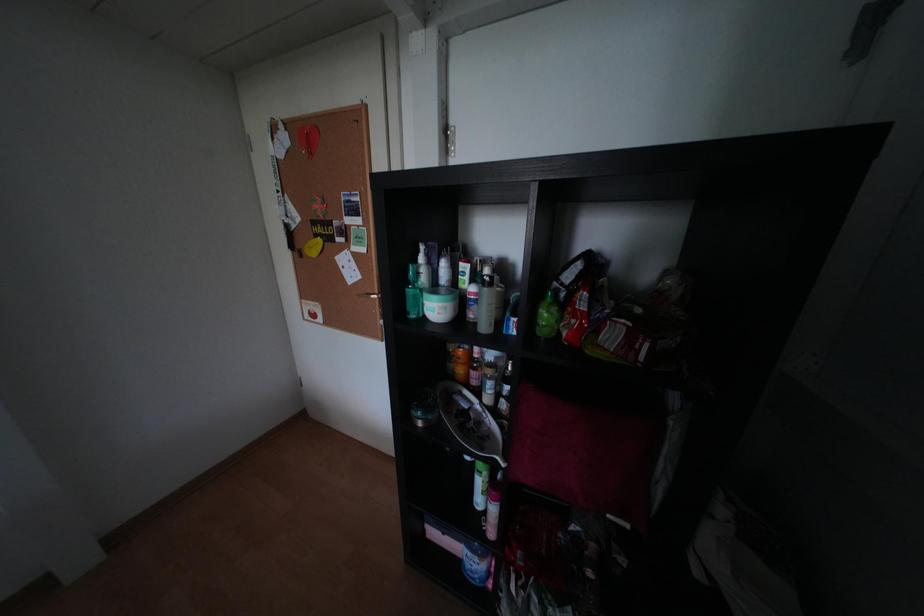
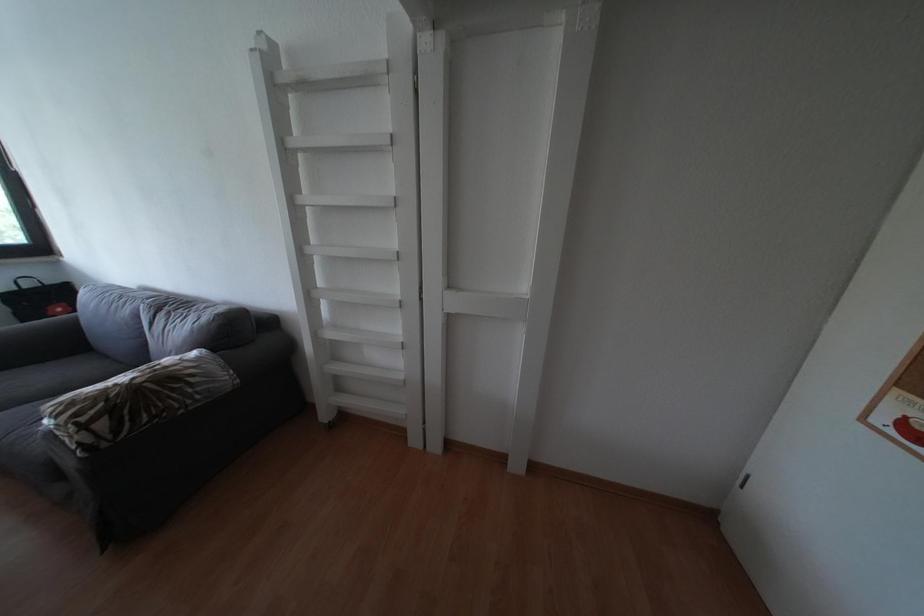
Question: Based on the continuous images, in which direction is the camera rotating? Reply with the corresponding letter.

Choices:
 (A) Left
 (B) Right
 (C) Up
 (D) Down

Answer: (A)